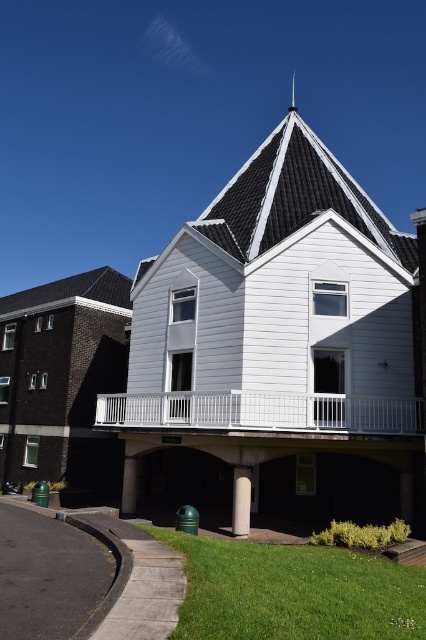
The image size is (426, 640). I want to click on white smooth pillar at lower center, so click(241, 500).

Locate an element on the screen. This screenshot has height=640, width=426. white smooth pillar at lower center is located at coordinates click(x=241, y=500).

Where is `white painted wood balcony at center`? Image resolution: width=426 pixels, height=640 pixels. white painted wood balcony at center is located at coordinates (261, 412).

Is white painted wood balcony at center wider than shiny silver spire at upper center?

Indeed, white painted wood balcony at center has a greater width compared to shiny silver spire at upper center.

Can you confirm if white painted wood balcony at center is positioned above shiny silver spire at upper center?

No.

Where is `white painted wood balcony at center`? white painted wood balcony at center is located at coordinates (261, 412).